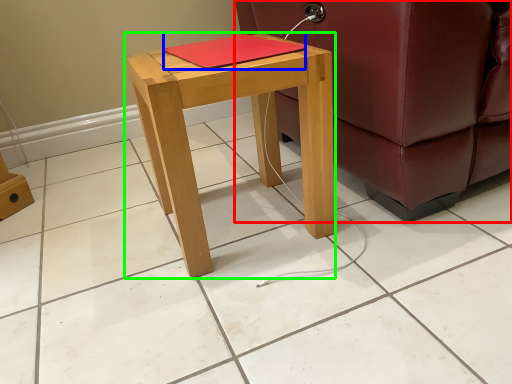
Question: Estimate the real-world distances between objects in this image. Which object is closer to studio couch (highlighted by a red box), notebook (highlighted by a blue box) or stool (highlighted by a green box)?

Choices:
 (A) notebook
 (B) stool

Answer: (B)